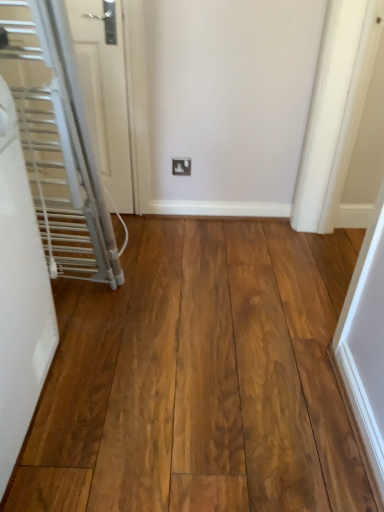
Locate an element on the screen. vacant space behind white matte radiator at left, which appears as the 1th door when viewed from the front is located at coordinates (106, 312).